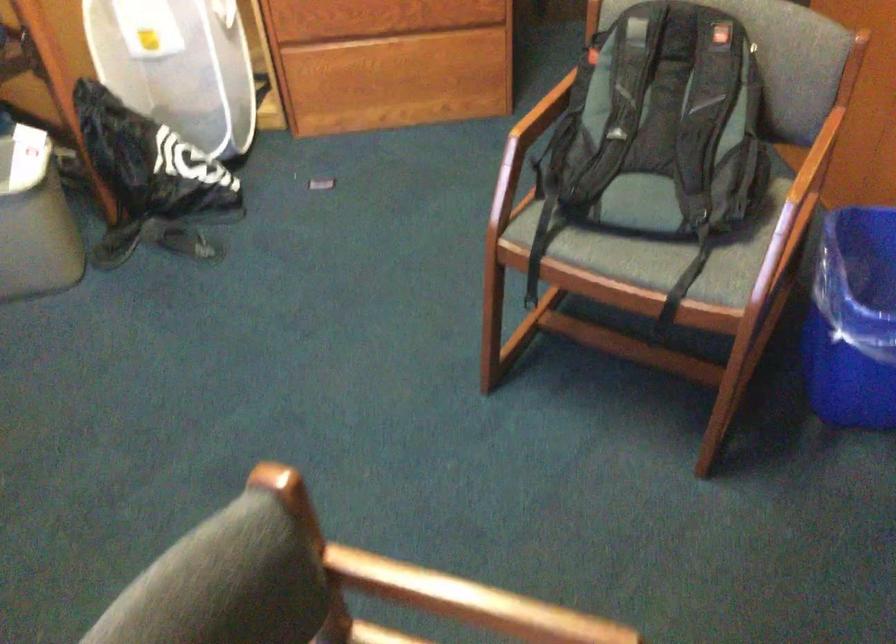
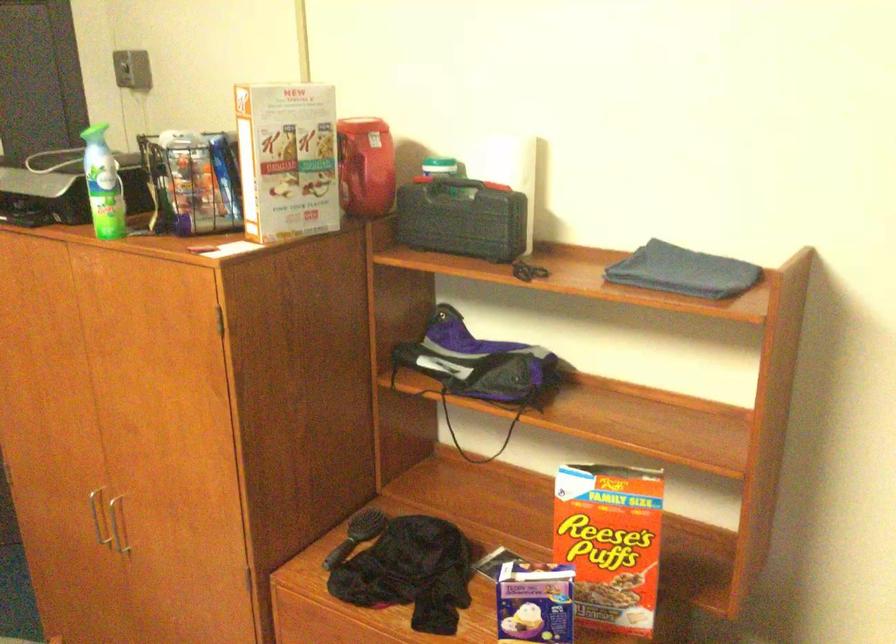
Question: The camera is either moving clockwise (left) or counter-clockwise (right) around the object. The first image is from the beginning of the video and the second image is from the end. Is the camera moving left or right when shooting the video?

Choices:
 (A) Left
 (B) Right

Answer: (A)